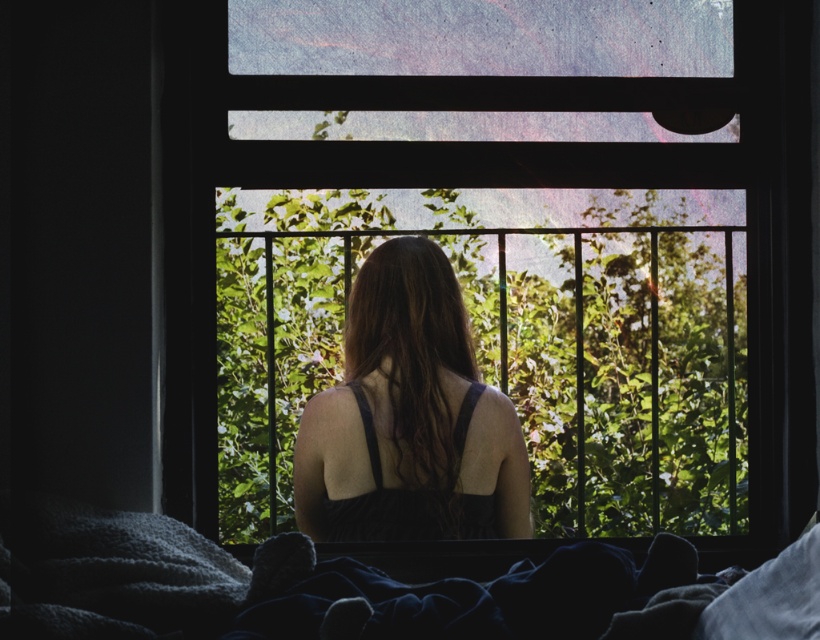
You are lying on a bed in the room and want to grab the matte black dress at center. However, there is a soft woolen blanket at lower left in your way. Can you move the blanket to reach the dress?

The soft woolen blanket at lower left is positioned on the left side of matte black dress at center, so you can move the blanket to the left to access the dress.

You are trying to determine if you can hang a picture frame that is 1 meter tall on the transparent glass window at center without covering the matte black dress at center. Given their heights, is this possible?

The transparent glass window at center is taller than the matte black dress at center. Since the window is taller, the picture frame of 1 meter can be placed above or below the dress without covering it, provided there is enough vertical space on the window.

You are trying to decide whether to place a new painting on the wall behind the transparent glass window at center or next to the matte black dress at center. Based on their sizes, which location would allow the painting to fit better?

The transparent glass window at center has a larger size compared to matte black dress at center, so the painting would fit better behind the transparent glass window at center.